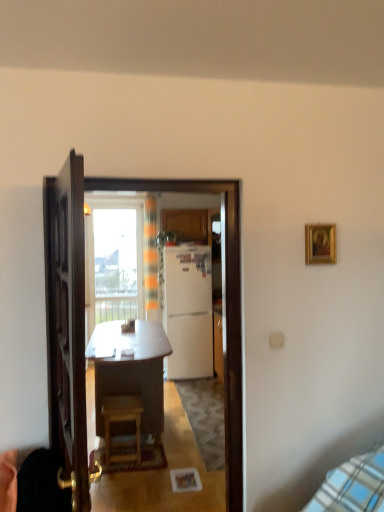
Question: Is gold-framed picture at upper right wider or thinner than transparent glass window at upper center?

Choices:
 (A) wide
 (B) thin

Answer: (B)

Question: Is gold-framed picture at upper right in front of or behind transparent glass window at upper center in the image?

Choices:
 (A) behind
 (B) front

Answer: (B)

Question: Which object is the closest to the matte wood cabinet at center?

Choices:
 (A) white matte refrigerator at center
 (B) transparent glass window at upper center
 (C) wooden desk at center
 (D) wooden door at center
 (E) wooden stool at center

Answer: (A)

Question: Estimate the real-world distances between objects in this image. Which object is closer to the white glossy refrigerator at center?

Choices:
 (A) wooden stool at center
 (B) transparent glass window at upper center
 (C) wooden door at center
 (D) matte wood cabinet at center
 (E) wooden desk at center

Answer: (C)